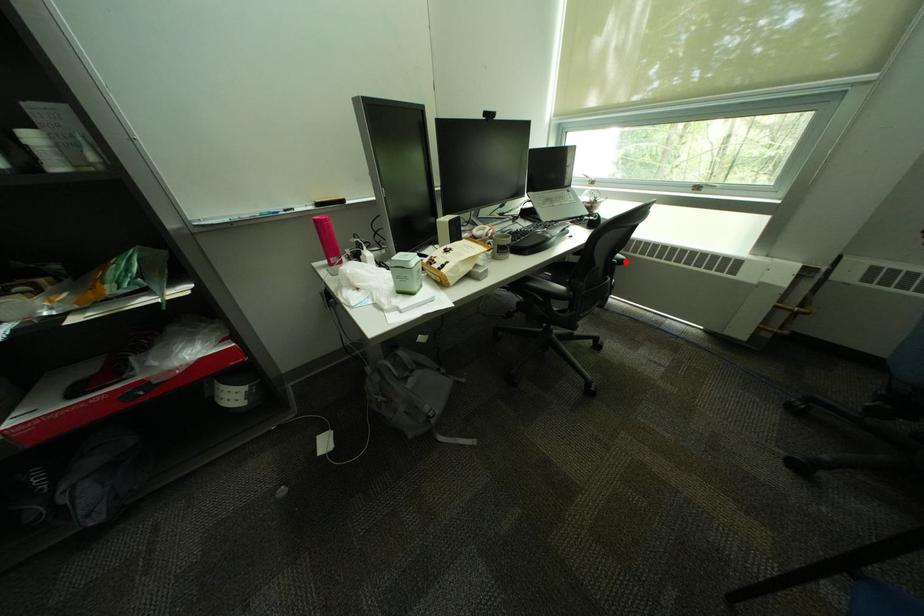
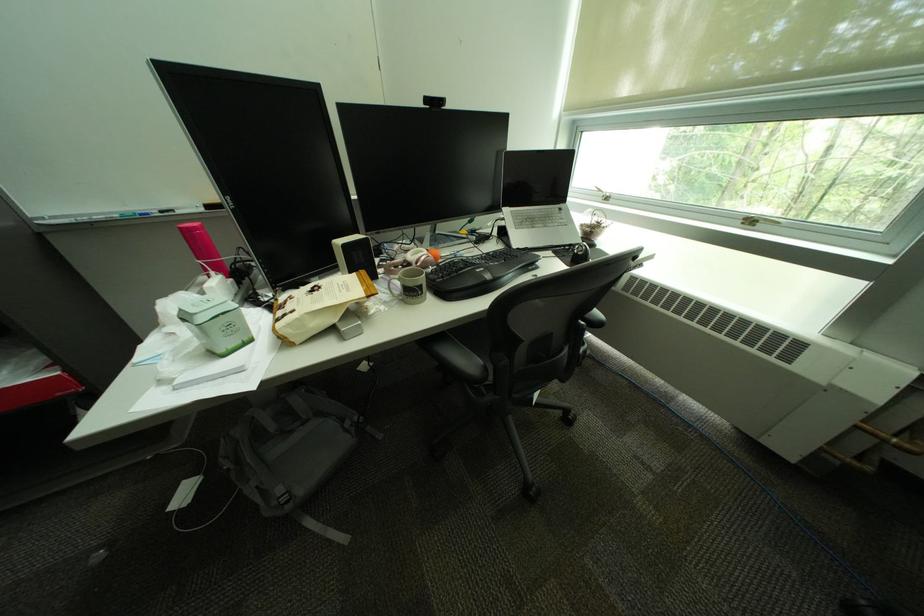
In the second image, find the point that corresponds to the highlighted location in the first image.

(593, 323)